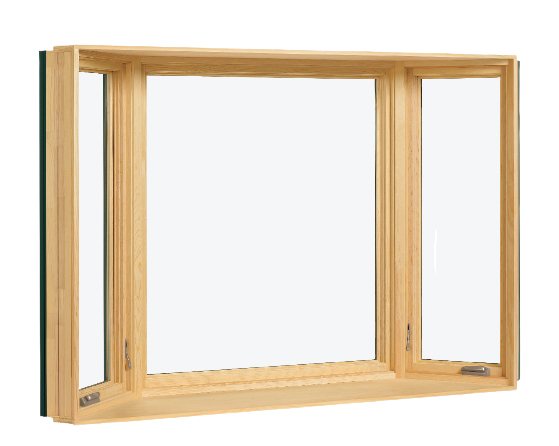
I want to click on raw wooden frame window, so click(64, 249).